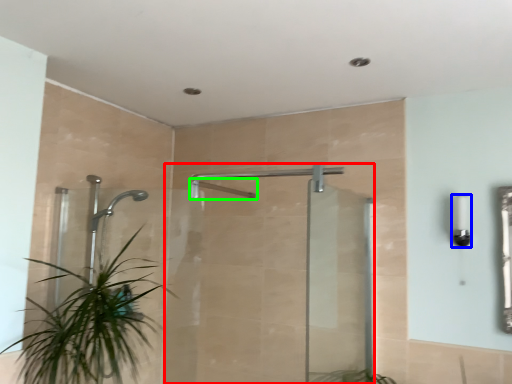
Question: Which object is the closest to the screen door (highlighted by a red box)? Choose among these: light fixture (highlighted by a blue box) or shower (highlighted by a green box).

Choices:
 (A) light fixture
 (B) shower

Answer: (B)